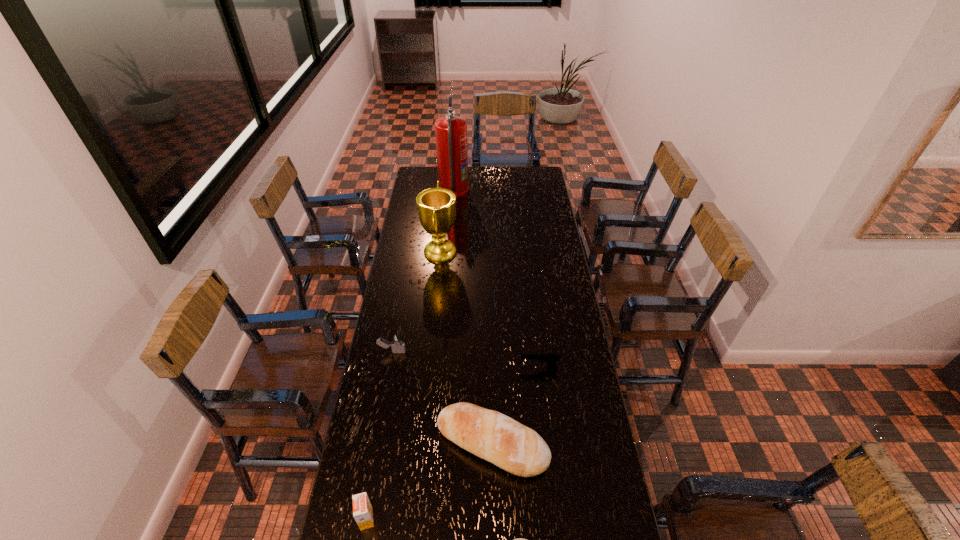
Locate an element on the screen. The image size is (960, 540). orange juice present at the left edge is located at coordinates 362,509.

Find the location of a particular element. Image resolution: width=960 pixels, height=540 pixels. igniter positioned at the left edge is located at coordinates (397, 344).

In order to click on object at the right edge in this screenshot , I will do `click(550, 358)`.

Find the location of a particular element. object positioned at the far left corner is located at coordinates (450, 131).

The width and height of the screenshot is (960, 540). I want to click on vacant position at the far edge of the desktop, so click(491, 167).

Where is `blank area at the left edge`? blank area at the left edge is located at coordinates (345, 506).

The height and width of the screenshot is (540, 960). In order to click on vacant space at the right edge of the desktop in this screenshot , I will do `click(544, 238)`.

Locate an element on the screen. vacant area at the far left corner of the desktop is located at coordinates (414, 179).

Locate an element on the screen. free spot between the sixth nearest object and the igniter is located at coordinates (417, 301).

Image resolution: width=960 pixels, height=540 pixels. I want to click on free point between the sixth shortest object and the fifth nearest object, so click(417, 301).